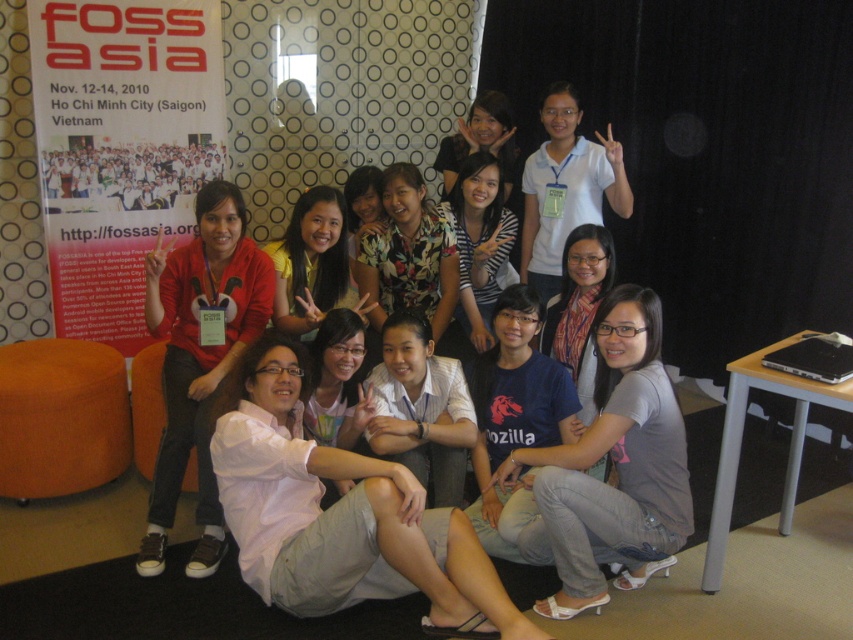
Question: Which object is farther from the camera taking this photo?

Choices:
 (A) white paper poster at left
 (B) gray fabric shirt at lower center
 (C) matte black shirt at center
 (D) floral fabric shirt at center

Answer: (C)

Question: Does gray fabric shirt at lower center come in front of white cotton shirt at center?

Choices:
 (A) no
 (B) yes

Answer: (B)

Question: Can you confirm if pink cotton shirt at center is wider than gray fabric shirt at lower center?

Choices:
 (A) yes
 (B) no

Answer: (A)

Question: Which object appears farthest from the camera in this image?

Choices:
 (A) striped shirt at center
 (B) matte black shirt at center
 (C) floral fabric shirt at center
 (D) floral fabric blouse at center

Answer: (B)

Question: Which object is the farthest from the pink cotton shirt at center?

Choices:
 (A) white paper poster at left
 (B) gray fabric shirt at lower center

Answer: (A)

Question: Is white cotton shirt at center positioned before floral fabric blouse at center?

Choices:
 (A) yes
 (B) no

Answer: (A)